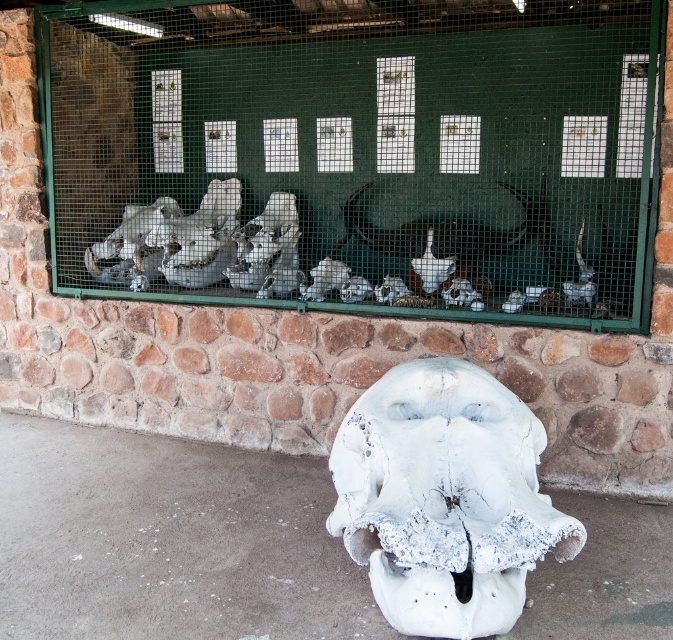
Question: Can you confirm if white matte skull at center is positioned above white matte skull at lower center?

Choices:
 (A) no
 (B) yes

Answer: (B)

Question: Is white matte skull at center smaller than white matte skull at lower center?

Choices:
 (A) no
 (B) yes

Answer: (A)

Question: Is white matte skull at center further to the viewer compared to white matte skull at lower center?

Choices:
 (A) yes
 (B) no

Answer: (A)

Question: Which of the following is the closest to the observer?

Choices:
 (A) white matte skull at center
 (B) white matte skull at lower center

Answer: (B)

Question: Which of the following is the farthest from the observer?

Choices:
 (A) (503, 428)
 (B) (616, 115)

Answer: (B)